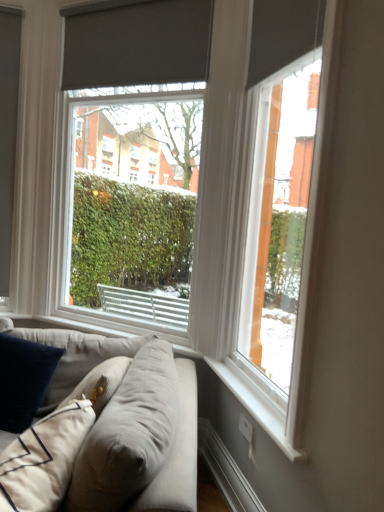
Question: From a real-world perspective, is matte gray roller blind at center, the first window from the back, on velvety dark blue pillow at lower left?

Choices:
 (A) yes
 (B) no

Answer: (A)

Question: From the image's perspective, is matte gray roller blind at center, the 2th window viewed from the front, on velvety dark blue pillow at lower left?

Choices:
 (A) no
 (B) yes

Answer: (B)

Question: Is matte gray roller blind at center, the 2th window viewed from the right, surrounding velvety dark blue pillow at lower left?

Choices:
 (A) yes
 (B) no

Answer: (B)

Question: Is matte gray roller blind at center, the first window from the back, shorter than velvety dark blue pillow at lower left?

Choices:
 (A) no
 (B) yes

Answer: (A)

Question: Is matte gray roller blind at center, which is the 1th window in left-to-right order, aimed at velvety dark blue pillow at lower left?

Choices:
 (A) yes
 (B) no

Answer: (A)

Question: Is the position of matte gray roller blind at center, the first window from the back, more distant than that of velvety dark blue pillow at lower left?

Choices:
 (A) no
 (B) yes

Answer: (B)

Question: From a real-world perspective, is light gray fabric couch at lower left positioned over matte gray roller blind at right, the 2th window viewed from the left, based on gravity?

Choices:
 (A) no
 (B) yes

Answer: (A)

Question: Does light gray fabric couch at lower left contain matte gray roller blind at right, the 2th window viewed from the left?

Choices:
 (A) yes
 (B) no

Answer: (B)

Question: Is light gray fabric couch at lower left positioned in front of matte gray roller blind at right, the 2th window viewed from the left?

Choices:
 (A) yes
 (B) no

Answer: (A)

Question: Does light gray fabric couch at lower left have a greater height compared to matte gray roller blind at right, marked as the second window in a back-to-front arrangement?

Choices:
 (A) no
 (B) yes

Answer: (A)

Question: From a real-world perspective, is light gray fabric couch at lower left below matte gray roller blind at right, marked as the first window in a right-to-left arrangement?

Choices:
 (A) no
 (B) yes

Answer: (B)

Question: Is light gray fabric couch at lower left bigger than matte gray roller blind at right, marked as the first window in a right-to-left arrangement?

Choices:
 (A) yes
 (B) no

Answer: (A)

Question: Is matte gray roller blind at center, the 2th window viewed from the right, outside light gray fabric couch at lower left?

Choices:
 (A) no
 (B) yes

Answer: (B)